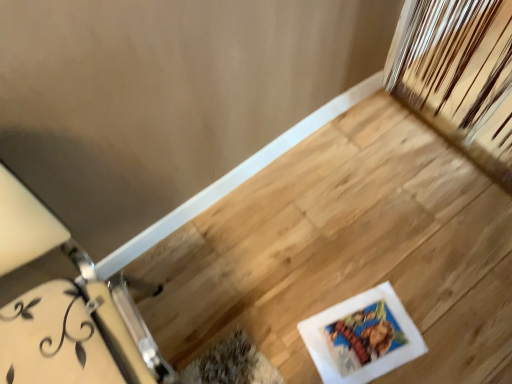
I want to click on white painted wood table at left, so click(67, 309).

What do you see at coordinates (67, 309) in the screenshot? I see `white painted wood table at left` at bounding box center [67, 309].

Image resolution: width=512 pixels, height=384 pixels. I want to click on white glossy picture frame at lower right, so click(x=362, y=337).

What is the approximate width of white glossy picture frame at lower right?

It is 27.42 centimeters.

What do you see at coordinates (362, 337) in the screenshot?
I see `white glossy picture frame at lower right` at bounding box center [362, 337].

Measure the distance between point [316,344] and camera.

Point [316,344] is 1.17 meters from camera.

Find the location of `white painted wood table at left`. white painted wood table at left is located at coordinates (67, 309).

Which is more to the right, white painted wood table at left or white glossy picture frame at lower right?

Answer: Positioned to the right is white glossy picture frame at lower right.

Relative to white glossy picture frame at lower right, is white painted wood table at left in front or behind?

Clearly, white painted wood table at left is in front of white glossy picture frame at lower right.

Is point (91, 338) more distant than point (350, 372)?

No, (91, 338) is in front of (350, 372).

From the image's perspective, is white painted wood table at left on white glossy picture frame at lower right?

Yes, from the image's perspective, white painted wood table at left is above white glossy picture frame at lower right.

From a real-world perspective, relative to white glossy picture frame at lower right, is white painted wood table at left vertically above or below?

Clearly, from a real-world perspective, white painted wood table at left is above white glossy picture frame at lower right.

Can you confirm if white painted wood table at left is thinner than white glossy picture frame at lower right?

In fact, white painted wood table at left might be wider than white glossy picture frame at lower right.

Who is taller, white painted wood table at left or white glossy picture frame at lower right?

With more height is white painted wood table at left.

Which of these two, white painted wood table at left or white glossy picture frame at lower right, is bigger?

Bigger between the two is white painted wood table at left.

Is white painted wood table at left outside of white glossy picture frame at lower right?

white painted wood table at left is positioned outside white glossy picture frame at lower right.

In the scene shown: Is white painted wood table at left with white glossy picture frame at lower right?

No, white painted wood table at left is not in contact with white glossy picture frame at lower right.

Is white painted wood table at left turned away from white glossy picture frame at lower right?

white painted wood table at left does not have its back to white glossy picture frame at lower right.

How many degrees apart are the facing directions of white painted wood table at left and white glossy picture frame at lower right?

0.915 degrees separate the facing orientations of white painted wood table at left and white glossy picture frame at lower right.

You are a GUI agent. You are given a task and a screenshot of the screen. Output one action in this format:
    pyautogui.click(x=<x>, y=<y>)
    Task: Click on the furniture that is on the left side of white glossy picture frame at lower right
    The height and width of the screenshot is (384, 512).
    Given the screenshot: What is the action you would take?
    pyautogui.click(x=67, y=309)

Which object is positioned more to the right, white glossy picture frame at lower right or white painted wood table at left?

white glossy picture frame at lower right is more to the right.

Between white glossy picture frame at lower right and white painted wood table at left, which one is positioned in front?

Positioned in front is white painted wood table at left.

Is point (337, 329) in front of point (45, 337)?

No, (337, 329) is further to viewer.

From the image's perspective, is white glossy picture frame at lower right above or below white painted wood table at left?

→ From the image's perspective, white glossy picture frame at lower right appears below white painted wood table at left.

From a real-world perspective, between white glossy picture frame at lower right and white painted wood table at left, who is vertically lower?

white glossy picture frame at lower right is physically lower.

Which object is thinner, white glossy picture frame at lower right or white painted wood table at left?

With smaller width is white glossy picture frame at lower right.

Who is taller, white glossy picture frame at lower right or white painted wood table at left?

With more height is white painted wood table at left.

Between white glossy picture frame at lower right and white painted wood table at left, which one has smaller size?

Smaller between the two is white glossy picture frame at lower right.

Is white glossy picture frame at lower right located outside white painted wood table at left?

Yes, white glossy picture frame at lower right is not within white painted wood table at left.

Is there a large distance between white glossy picture frame at lower right and white painted wood table at left?

No.

Is white glossy picture frame at lower right positioned with its back to white painted wood table at left?

No.

How different are the orientations of white glossy picture frame at lower right and white painted wood table at left in degrees?

The facing directions of white glossy picture frame at lower right and white painted wood table at left are 0.915 degrees apart.

The image size is (512, 384). I want to click on furniture in front of the white glossy picture frame at lower right, so click(67, 309).

Locate an element on the screen. The height and width of the screenshot is (384, 512). furniture lying on the left of white glossy picture frame at lower right is located at coordinates (67, 309).

At what (x,y) coordinates should I click in order to perform the action: click on furniture positioned vertically above the white glossy picture frame at lower right (from a real-world perspective). Please return your answer as a coordinate pair (x, y). Looking at the image, I should click on (67, 309).